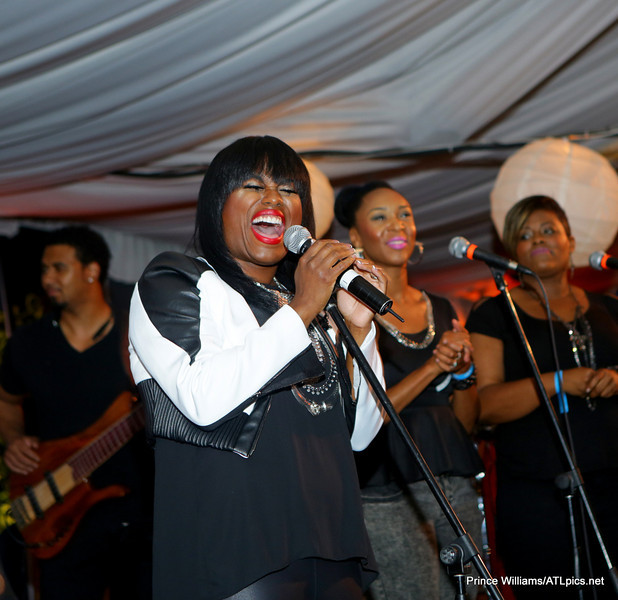
Identify the location of lights. (321, 203), (543, 173).